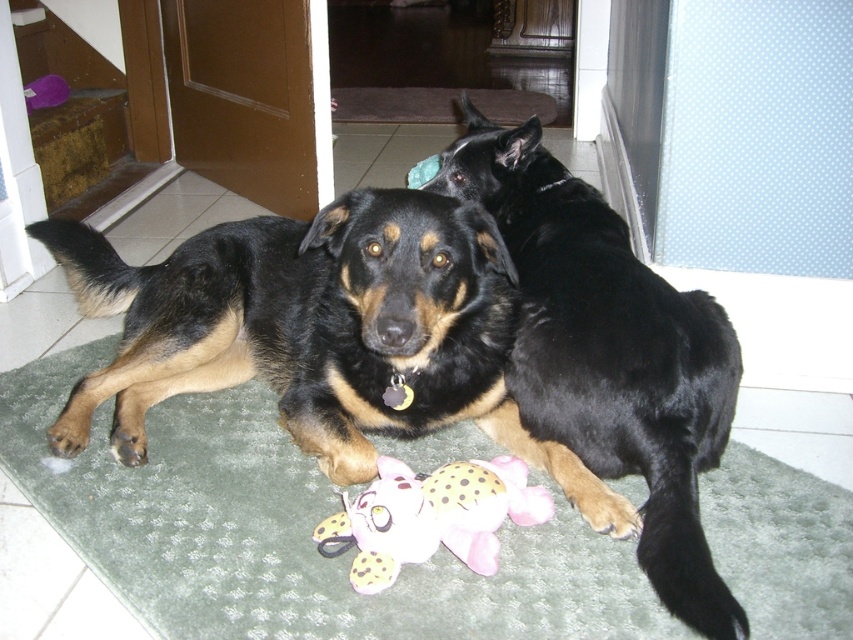
Based on the photo, who is positioned more to the right, black fur dog at center or pink plush toy at center?

pink plush toy at center is more to the right.

Which is behind, point (270, 236) or point (369, 499)?

Point (270, 236)

I want to click on black fur dog at center, so click(318, 332).

Where is `black fur dog at center`? This screenshot has height=640, width=853. black fur dog at center is located at coordinates (318, 332).

Is black fur dog at center smaller than black shiny fur dog at center?

Incorrect, black fur dog at center is not smaller in size than black shiny fur dog at center.

Measure the distance from black fur dog at center to black shiny fur dog at center.

black fur dog at center is 34.13 centimeters from black shiny fur dog at center.

What do you see at coordinates (318, 332) in the screenshot?
I see `black fur dog at center` at bounding box center [318, 332].

Locate an element on the screen. The height and width of the screenshot is (640, 853). black fur dog at center is located at coordinates (318, 332).

I want to click on green carpet at center, so click(x=288, y=532).

Which of these two, green carpet at center or black fur dog at center, stands taller?

Standing taller between the two is black fur dog at center.

You are a GUI agent. You are given a task and a screenshot of the screen. Output one action in this format:
    pyautogui.click(x=<x>, y=<y>)
    Task: Click on the green carpet at center
    This screenshot has width=853, height=640.
    Given the screenshot: What is the action you would take?
    pos(288,532)